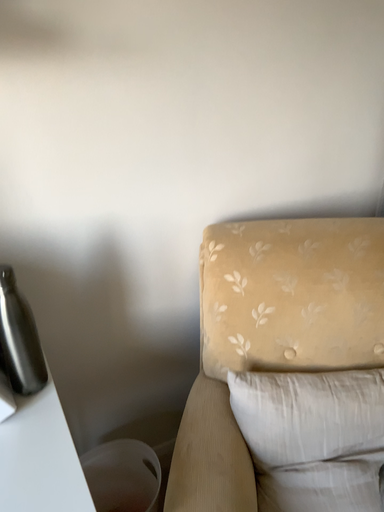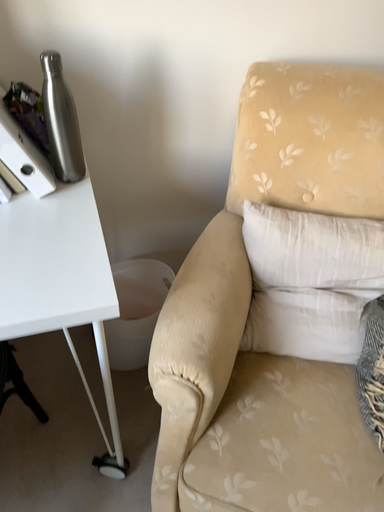
Question: Which way did the camera rotate in the video?

Choices:
 (A) rotated right
 (B) rotated left

Answer: (B)